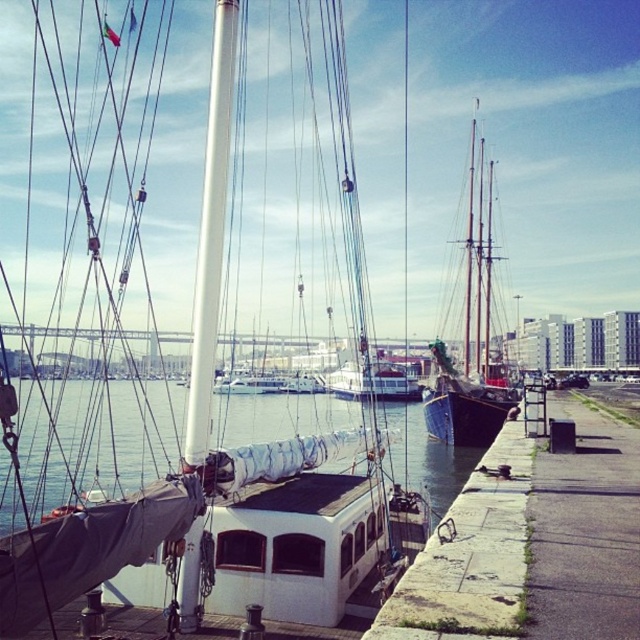
Locate an element on the screen. Image resolution: width=640 pixels, height=640 pixels. white matte water at center is located at coordinates (307, 544).

Does white matte water at center have a larger size compared to white glossy sailboat at center?

Incorrect, white matte water at center is not larger than white glossy sailboat at center.

At what (x,y) coordinates should I click in order to perform the action: click on white matte water at center. Please return your answer as a coordinate pair (x, y). Looking at the image, I should click on (307, 544).

Is dark blue wooden sailboat at center below white glossy sailboat at center?

Incorrect, dark blue wooden sailboat at center is not positioned below white glossy sailboat at center.

Does dark blue wooden sailboat at center appear on the left side of white glossy sailboat at center?

In fact, dark blue wooden sailboat at center is to the right of white glossy sailboat at center.

Image resolution: width=640 pixels, height=640 pixels. Identify the location of dark blue wooden sailboat at center. (470, 340).

Find the location of a particular element. The image size is (640, 640). dark blue wooden sailboat at center is located at coordinates (470, 340).

Is white matte water at center below dark blue wooden sailboat at center?

Indeed, white matte water at center is positioned under dark blue wooden sailboat at center.

You are a GUI agent. You are given a task and a screenshot of the screen. Output one action in this format:
    pyautogui.click(x=<x>, y=<y>)
    Task: Click on the white matte water at center
    
    Given the screenshot: What is the action you would take?
    coord(307,544)